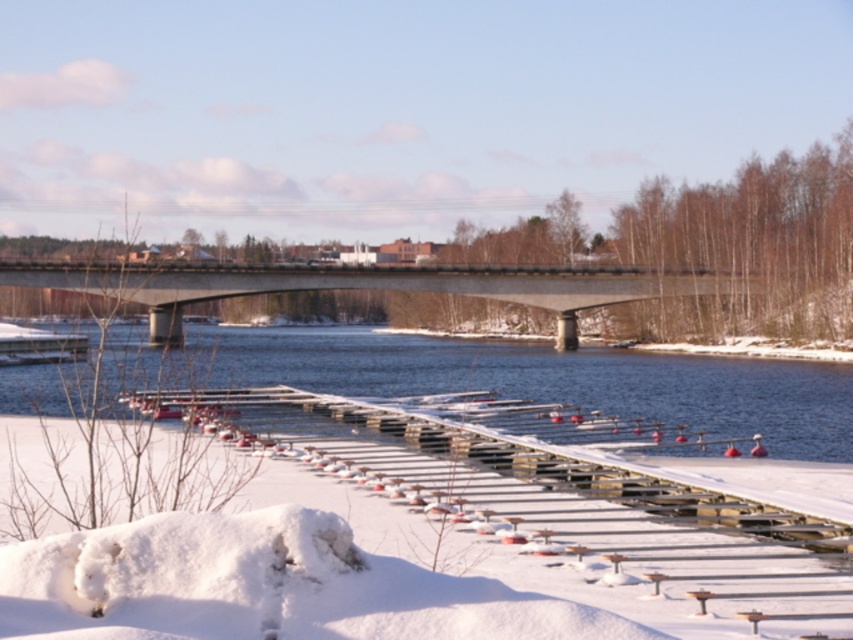
Does blue water at center have a greater width compared to concrete bridge at center?

In fact, blue water at center might be narrower than concrete bridge at center.

Between point (837, 435) and point (575, 342), which one is positioned behind?

The point (575, 342) is more distant.

Where is `blue water at center`? This screenshot has width=853, height=640. blue water at center is located at coordinates (515, 378).